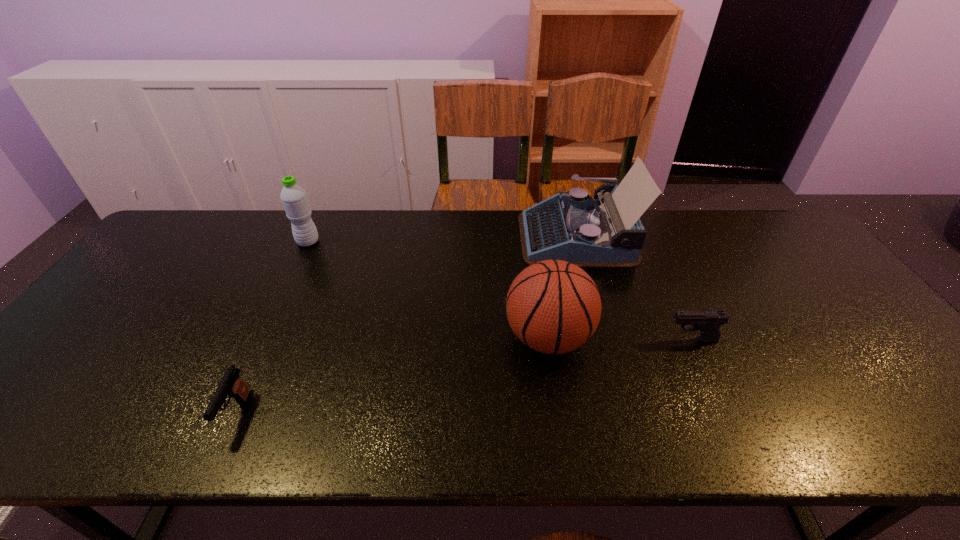
Locate an element on the screen. The image size is (960, 540). typewriter is located at coordinates (589, 233).

Find the location of a particular element. water bottle is located at coordinates (294, 199).

Where is `basketball`? basketball is located at coordinates (554, 307).

Locate an element on the screen. the farther pistol is located at coordinates (708, 322).

Identify the location of the left pistol. The width and height of the screenshot is (960, 540). (231, 385).

The width and height of the screenshot is (960, 540). I want to click on the nearest object, so click(231, 385).

You are a GUI agent. You are given a task and a screenshot of the screen. Output one action in this format:
    pyautogui.click(x=<x>, y=<y>)
    Task: Click on the vacant space located 0.300m on the typing side of the typewriter
    The width and height of the screenshot is (960, 540).
    Given the screenshot: What is the action you would take?
    pyautogui.click(x=428, y=237)

Find the location of `vacant point located 0.150m on the typing side of the typewriter`. vacant point located 0.150m on the typing side of the typewriter is located at coordinates (474, 237).

Find the location of `free location located 0.380m on the typing side of the typewriter`. free location located 0.380m on the typing side of the typewriter is located at coordinates (403, 237).

Identify the location of free space located 0.070m on the back of the water bottle. This screenshot has height=540, width=960. (317, 222).